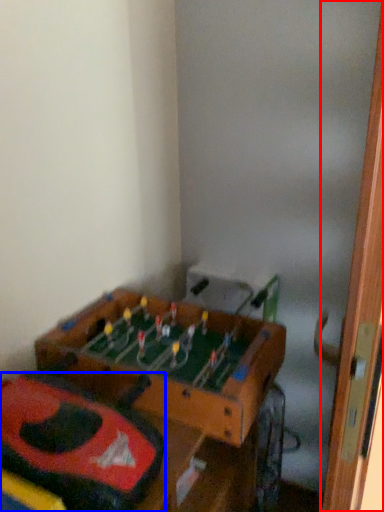
Question: Which point is further to the camera, door (highlighted by a red box) or kit (highlighted by a blue box)?

Choices:
 (A) door
 (B) kit

Answer: (B)